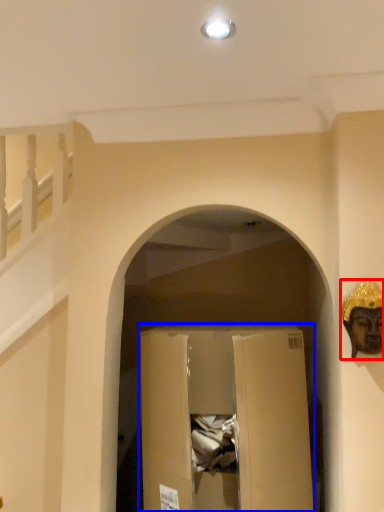
Question: Which of the following is the closest to the observer, construction worker (highlighted by a red box) or cardboard box (highlighted by a blue box)?

Choices:
 (A) construction worker
 (B) cardboard box

Answer: (A)